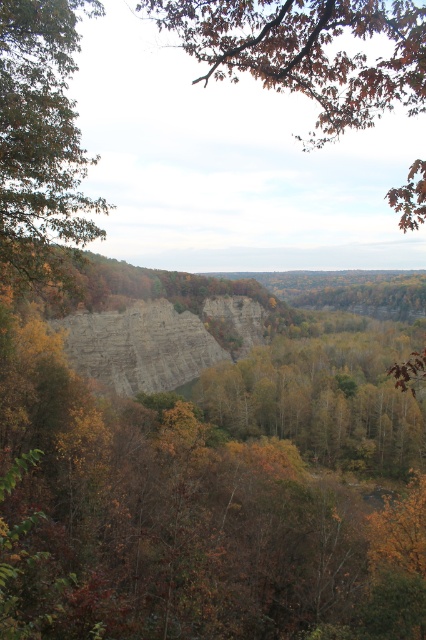
From the picture: Which of these two, brown matte tree at left or gray rocky cliff at center, stands taller?

brown matte tree at left is taller.

Which is more to the left, brown matte tree at left or gray rocky cliff at center?

brown matte tree at left is more to the left.

Between point (11, 205) and point (198, 328), which one is positioned behind?

Positioned behind is point (198, 328).

Image resolution: width=426 pixels, height=640 pixels. Find the location of `brown matte tree at left`. brown matte tree at left is located at coordinates (40, 140).

Based on the photo, which of these two, brown leafy branch at upper center or gray rocky cliff at center, stands shorter?

gray rocky cliff at center is shorter.

This screenshot has height=640, width=426. What are the coordinates of `brown leafy branch at upper center` in the screenshot? It's located at (307, 51).

You are a GUI agent. You are given a task and a screenshot of the screen. Output one action in this format:
    pyautogui.click(x=<x>, y=<y>)
    Task: Click on the brown leafy branch at upper center
    
    Given the screenshot: What is the action you would take?
    pyautogui.click(x=307, y=51)

Can you confirm if brown leafy branch at upper center is positioned to the right of brown matte tree at left?

Yes, brown leafy branch at upper center is to the right of brown matte tree at left.

Who is taller, brown leafy branch at upper center or brown matte tree at left?

Standing taller between the two is brown leafy branch at upper center.

Find the location of a particular element. The image size is (426, 640). brown leafy branch at upper center is located at coordinates (307, 51).